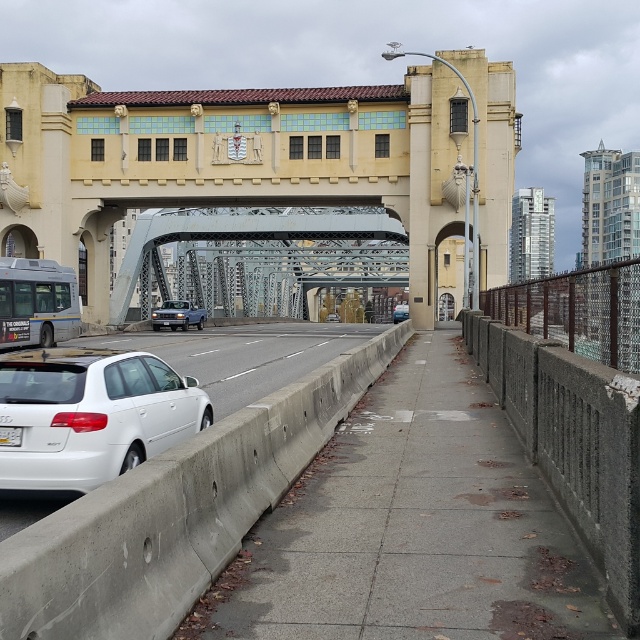
You are a delivery person trying to load a package onto a platform that requires the vehicle to be at least 1.8 meters tall. You have access to the silver metallic bus at left and the satin blue sedan at center. Which vehicle meets the height requirement?

The silver metallic bus at left is taller than the satin blue sedan at center, so the silver metallic bus at left meets the height requirement for the platform.

You are a pedestrian standing on the sidewalk and want to cross the road to reach the bus stop located near the metallic gray bridge at center. Which direction should you walk to first locate the matte black sedan at center before proceeding?

The metallic gray bridge at center is to the left of the matte black sedan at center, so you should walk to your left to first locate the matte black sedan at center before proceeding.

You are a pedestrian standing on the sidewalk and want to cross the road to reach the park on the other side. The metallic gray bridge at center and the matte black sedan at center are in your path. Which object is closer to you, the pedestrian, so you need to be cautious of first?

The metallic gray bridge at center is in front of the matte black sedan at center, meaning it is closer to you. Therefore, you should be cautious of the metallic gray bridge at center first before proceeding.